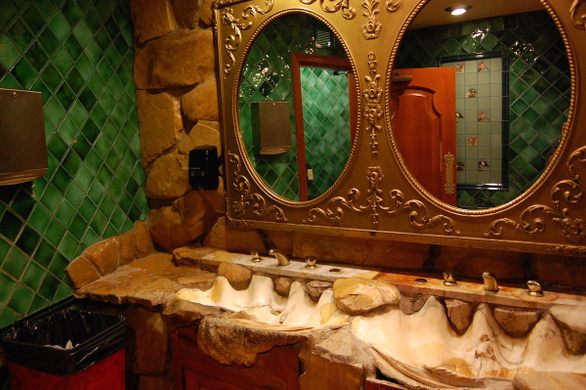
Locate an element on the screen. trash can is located at coordinates tap(4, 334), tap(76, 300), tap(124, 320), tap(124, 385), tap(71, 387), tap(11, 383).